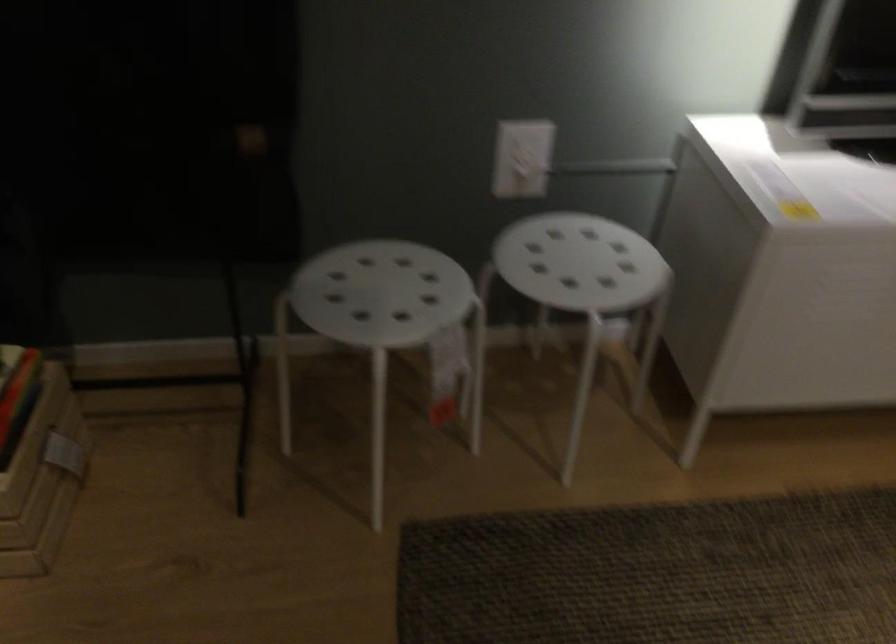
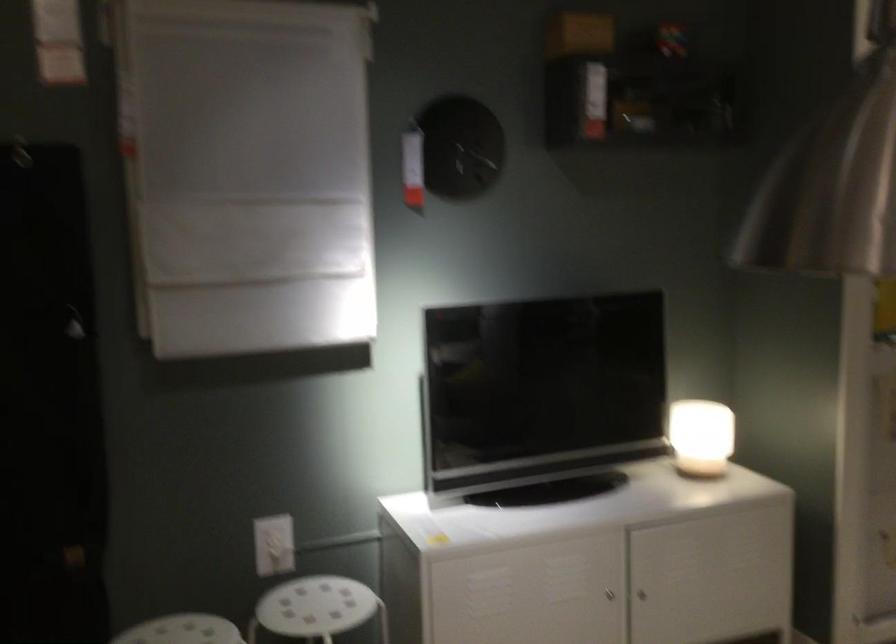
The point at (521, 152) is marked in the first image. Where is the corresponding point in the second image?

(273, 545)